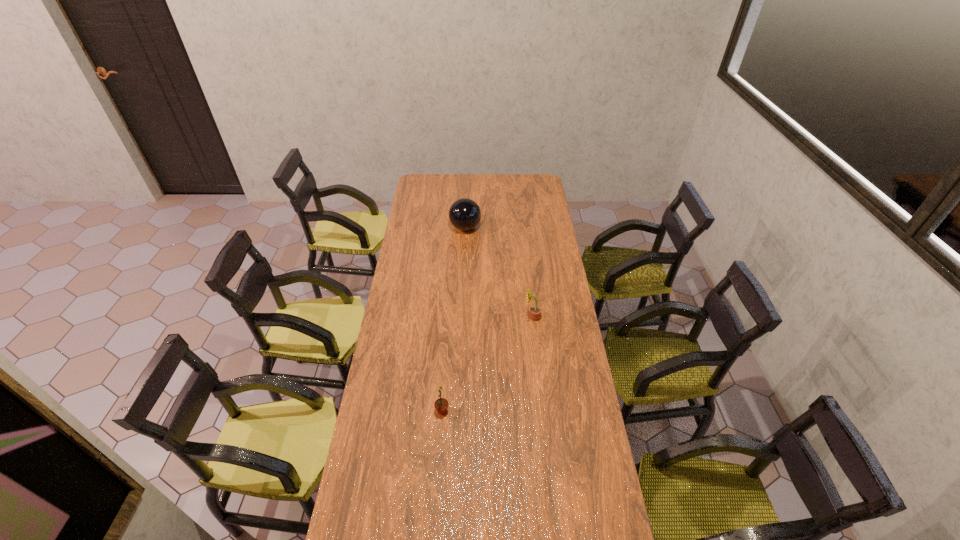
Locate an element on the screen. object present at the right edge is located at coordinates (535, 311).

Find the location of a particular element. The image size is (960, 540). free spot at the far edge of the desktop is located at coordinates (484, 183).

In the image, there is a desktop. Identify the location of free space at the left edge. (420, 312).

In the image, there is a desktop. Where is `vacant space at the right edge`? vacant space at the right edge is located at coordinates (602, 464).

Where is `vacant space at the far right corner of the desktop`? vacant space at the far right corner of the desktop is located at coordinates click(526, 193).

This screenshot has width=960, height=540. Identify the location of vacant space that's between the second farthest object and the bowling ball. (499, 272).

Identify the location of unoccupied area between the farthest object and the left sunflower. (454, 319).

Locate an element on the screen. vacant space that is in between the left sunflower and the farther sunflower is located at coordinates (488, 364).

Identify the location of vacant area that lies between the farthest object and the farther sunflower. pos(499,272).

Identify the location of vacant space that's between the right sunflower and the nearest object. (488, 364).